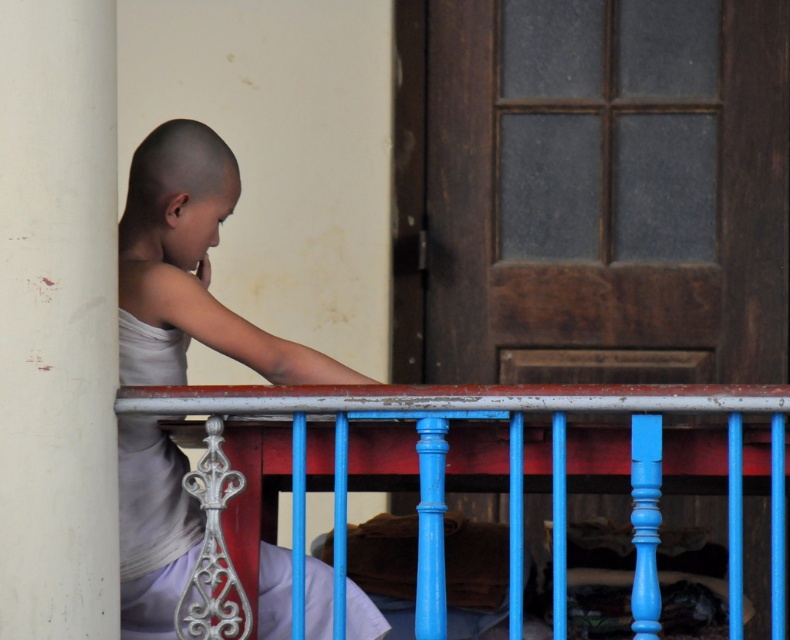
You are standing in front of the balcony and want to place a small decoration between the two points, point 1 at coordinates point (766, 483) and point 2 at coordinates point (166, 308). Which point should the decoration be closer to in order to appear larger to someone viewing from your position?

To make the decoration appear larger to someone viewing from your position, it should be placed closer to point (766, 483) because it is further away from the camera, so objects closer to this point would be magnified more in the viewer perspective.

You are standing on the balcony and want to place a small plant pot on the white matte pillar at left. However, there is already the white matte shirt at left there. Can you place the plant pot on the pillar without moving the shirt?

The white matte pillar at left is positioned over the white matte shirt at left, meaning the shirt is below the pillar. Since the shirt is not on the pillar itself but rather at the same location but lower, you can place the plant pot on the pillar without disturbing the shirt.